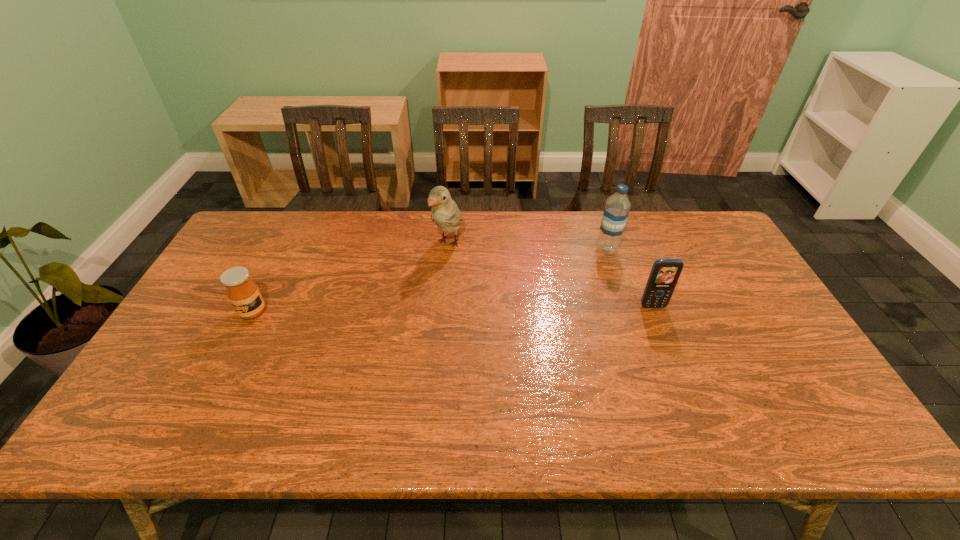
Locate an element on the screen. This screenshot has height=540, width=960. vacant area that lies between the second object from left to right and the leftmost object is located at coordinates (350, 278).

The width and height of the screenshot is (960, 540). I want to click on unoccupied area between the rightmost object and the leftmost object, so click(x=453, y=309).

This screenshot has width=960, height=540. Find the location of `free space between the second object from right to left and the bird`. free space between the second object from right to left and the bird is located at coordinates (528, 246).

Identify which object is located as the second nearest to the honey. Please provide its 2D coordinates. Your answer should be formatted as a tuple, i.e. [(x, y)], where the tuple contains the x and y coordinates of a point satisfying the conditions above.

[(617, 207)]

Identify which object is the closest to the water bottle. Please provide its 2D coordinates. Your answer should be formatted as a tuple, i.e. [(x, y)], where the tuple contains the x and y coordinates of a point satisfying the conditions above.

[(664, 275)]